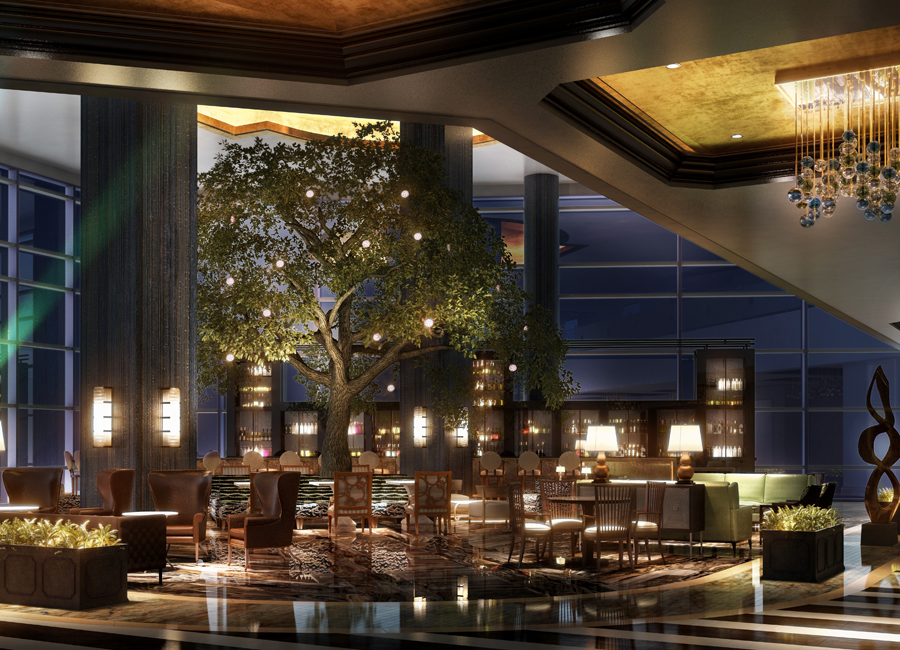
This screenshot has width=900, height=650. In order to click on glass windows in this screenshot , I will do `click(787, 382)`, `click(58, 325)`.